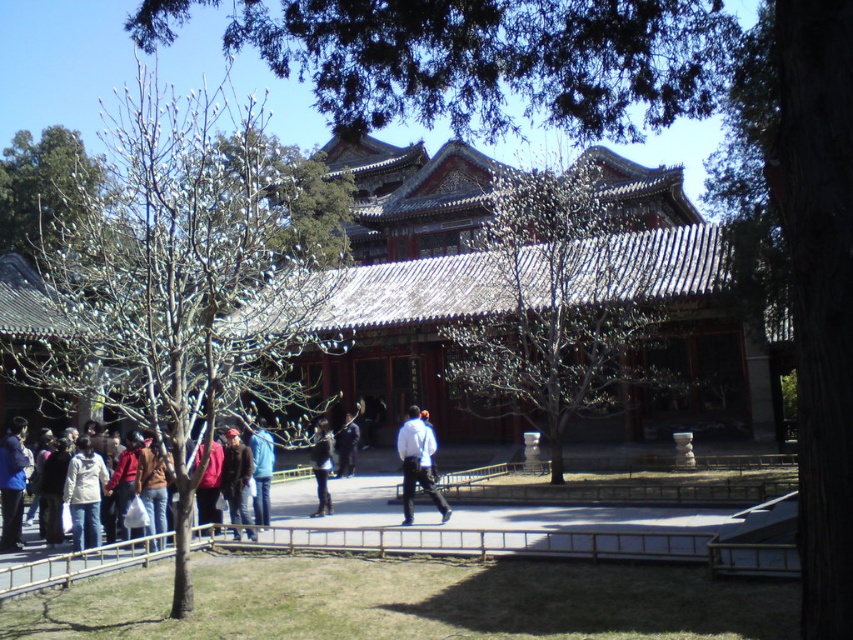
Where is `white textured tree at center`? white textured tree at center is located at coordinates (561, 292).

Can you confirm if white textured tree at center is positioned above multicolored clothing at lower left?

Indeed, white textured tree at center is positioned over multicolored clothing at lower left.

The width and height of the screenshot is (853, 640). What do you see at coordinates (561, 292) in the screenshot?
I see `white textured tree at center` at bounding box center [561, 292].

Locate an element on the screen. This screenshot has width=853, height=640. white textured tree at center is located at coordinates (561, 292).

From the picture: Is green leafy tree at upper left closer to the viewer compared to dark blue jacket at center?

No, it is behind dark blue jacket at center.

Is green leafy tree at upper left positioned behind dark blue jacket at center?

Yes, green leafy tree at upper left is behind dark blue jacket at center.

Locate an element on the screen. The height and width of the screenshot is (640, 853). green leafy tree at upper left is located at coordinates (42, 189).

Where is `green leafy tree at upper left`? The image size is (853, 640). green leafy tree at upper left is located at coordinates (42, 189).

Is point (317, 272) more distant than point (350, 428)?

Yes, point (317, 272) is behind point (350, 428).

You are a GUI agent. You are given a task and a screenshot of the screen. Output one action in this format:
    pyautogui.click(x=<x>, y=<y>)
    Task: Click on the bare branches at left
    Image resolution: width=853 pixels, height=640 pixels.
    Given the screenshot: What is the action you would take?
    pyautogui.click(x=183, y=282)